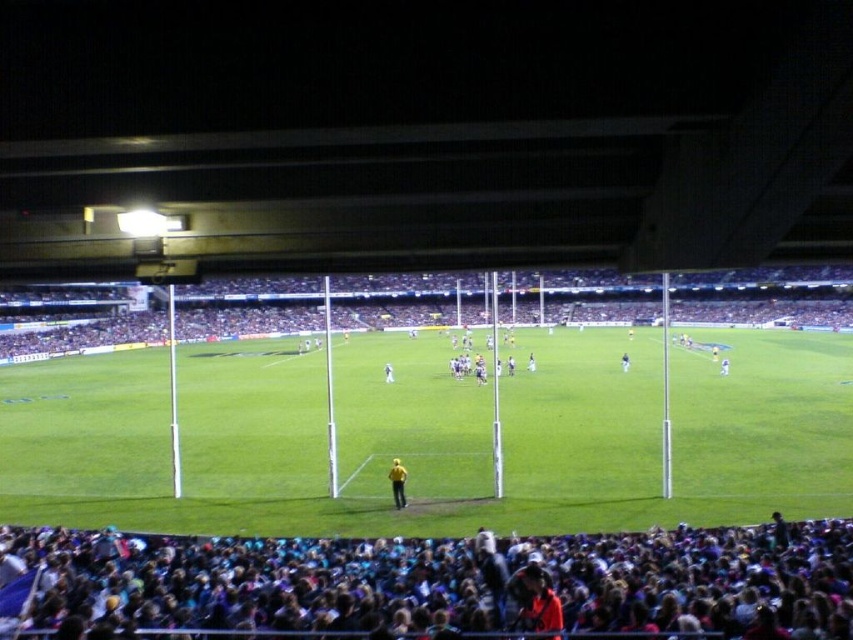
You are standing at the point marked as point (397, 483) in the stadium. What object is located exactly at that point?

The yellow fabric person at center is located exactly at point (397, 483).

You are a photographer standing at the edge of the stadium field. You want to take a photo of the green grass football field at center and the dark blue fabric at lower center. If your camera can focus on objects within 70 feet, will both objects be in focus?

The green grass football field at center is 71.72 feet away from the dark blue fabric at lower center. Since the distance between them exceeds the camera focus range of 70 feet, both objects might not be in focus simultaneously.